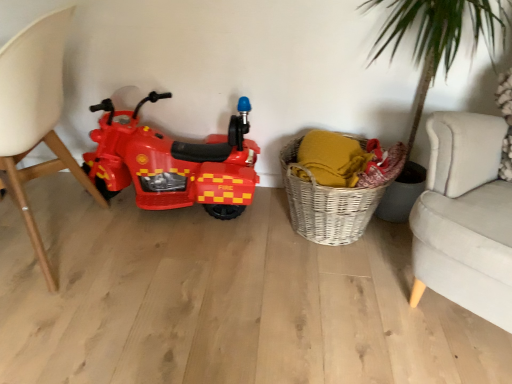
The width and height of the screenshot is (512, 384). I want to click on vacant area that lies in front of shiny plastic toy motorcycle at left, so click(173, 275).